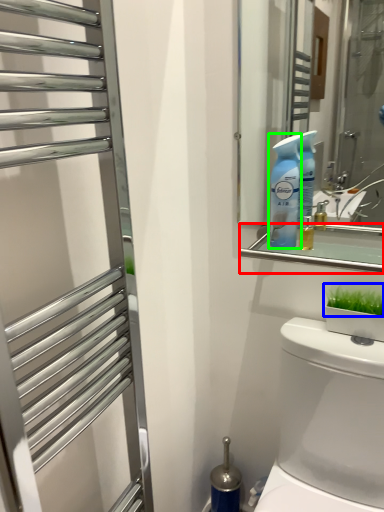
Question: Which object is the closest to the balustrade (highlighted by a red box)? Choose among these: plant (highlighted by a blue box) or cleaning product (highlighted by a green box).

Choices:
 (A) plant
 (B) cleaning product

Answer: (B)